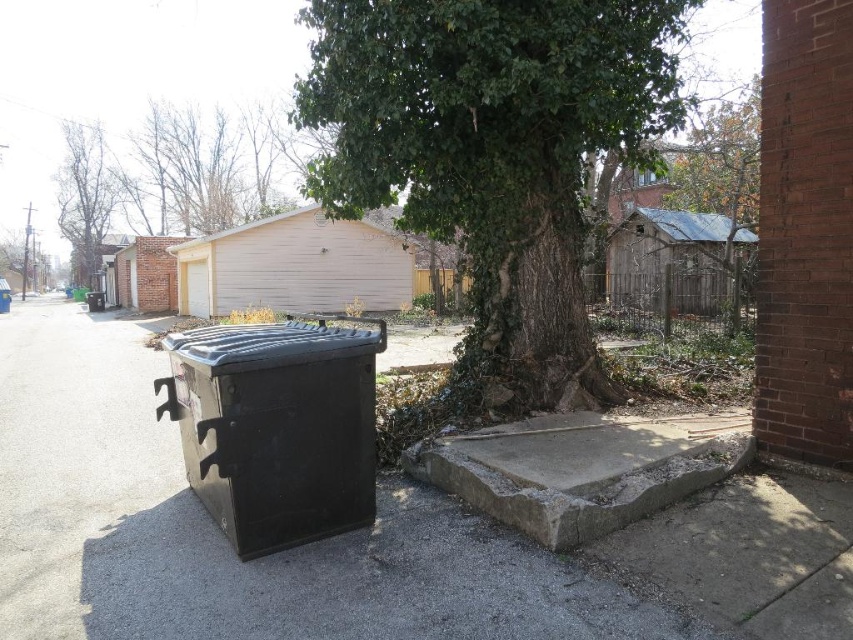
Question: Can you confirm if black plastic trash can at lower left is smaller than green ivy-covered tree at upper center?

Choices:
 (A) no
 (B) yes

Answer: (A)

Question: Among these objects, which one is nearest to the camera?

Choices:
 (A) green leafy tree at upper center
 (B) green leafy tree at center
 (C) gray concrete curb at lower center

Answer: (C)

Question: Is black plastic trash can at lower left further to the viewer compared to green ivy-covered tree at upper center?

Choices:
 (A) no
 (B) yes

Answer: (A)

Question: Which point is farther to the camera?

Choices:
 (A) green leafy tree at upper center
 (B) black plastic trash can at lower left

Answer: (A)

Question: Is green leafy tree at center above green ivy-covered tree at upper center?

Choices:
 (A) no
 (B) yes

Answer: (A)

Question: Among these objects, which one is nearest to the camera?

Choices:
 (A) black plastic trash can at lower left
 (B) gray concrete curb at lower center

Answer: (A)